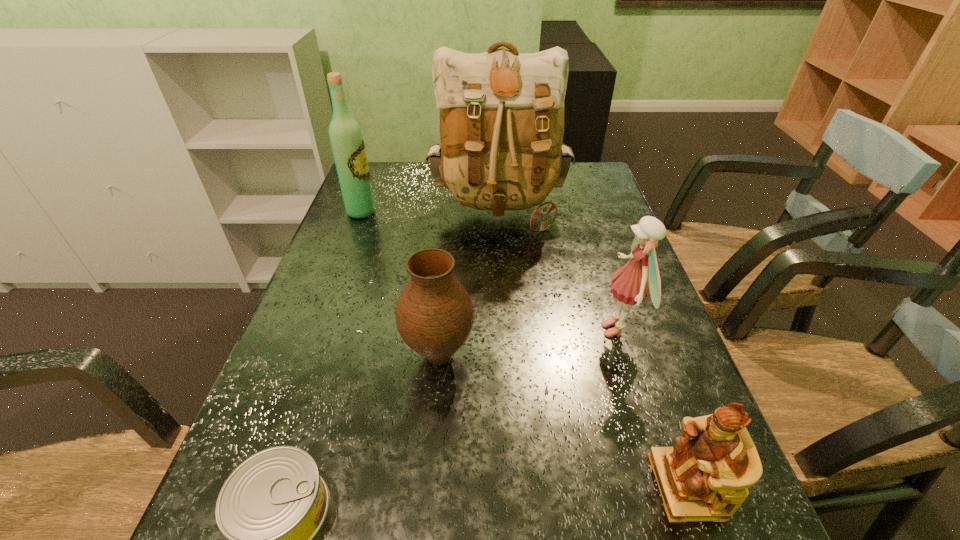
You are a GUI agent. You are given a task and a screenshot of the screen. Output one action in this format:
    pyautogui.click(x=<x>, y=<y>)
    Task: Click on the free location located on the back of the fourth tallest object
    This screenshot has height=540, width=960.
    Given the screenshot: What is the action you would take?
    pyautogui.click(x=447, y=257)

Locate an element on the screen. This screenshot has width=960, height=540. vacant space located on the front-facing side of the figurine is located at coordinates (473, 486).

The width and height of the screenshot is (960, 540). Identify the location of free space located on the front-facing side of the figurine. (497, 486).

At what (x,y) coordinates should I click in order to perform the action: click on vacant space located on the front-facing side of the figurine. Please return your answer as a coordinate pair (x, y). This screenshot has height=540, width=960. Looking at the image, I should click on (584, 486).

Identify the location of object located at the far edge. (501, 113).

Locate an element on the screen. Image resolution: width=960 pixels, height=540 pixels. object located in the left edge section of the desktop is located at coordinates (346, 139).

Find the location of a particular element. This screenshot has height=540, width=960. backpack that is positioned at the right edge is located at coordinates coord(501,113).

The width and height of the screenshot is (960, 540). In order to click on doll at the right edge in this screenshot , I will do `click(640, 276)`.

This screenshot has width=960, height=540. Find the location of `figurine located in the right edge section of the desktop`. figurine located in the right edge section of the desktop is located at coordinates (704, 477).

Identify the location of object present at the far right corner. The height and width of the screenshot is (540, 960). (501, 113).